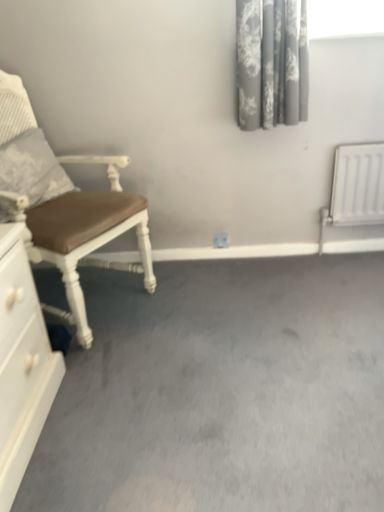
Question: Could you tell me if gray floral fabric curtain at upper right is facing white glossy chest of drawers at lower left?

Choices:
 (A) yes
 (B) no

Answer: (B)

Question: Can we say gray floral fabric curtain at upper right lies outside white glossy chest of drawers at lower left?

Choices:
 (A) yes
 (B) no

Answer: (A)

Question: Does gray floral fabric curtain at upper right appear on the left side of white glossy chest of drawers at lower left?

Choices:
 (A) yes
 (B) no

Answer: (B)

Question: Is gray floral fabric curtain at upper right bigger than white glossy chest of drawers at lower left?

Choices:
 (A) yes
 (B) no

Answer: (B)

Question: Does gray floral fabric curtain at upper right have a greater height compared to white glossy chest of drawers at lower left?

Choices:
 (A) no
 (B) yes

Answer: (A)

Question: Are gray floral fabric curtain at upper right and white glossy chest of drawers at lower left far apart?

Choices:
 (A) yes
 (B) no

Answer: (A)

Question: From the image's perspective, is textured gray pillow at left on top of brown leather chair at left?

Choices:
 (A) yes
 (B) no

Answer: (A)

Question: Could you tell me if textured gray pillow at left is facing brown leather chair at left?

Choices:
 (A) yes
 (B) no

Answer: (A)

Question: Is there a large distance between textured gray pillow at left and brown leather chair at left?

Choices:
 (A) yes
 (B) no

Answer: (B)

Question: From a real-world perspective, is textured gray pillow at left on top of brown leather chair at left?

Choices:
 (A) no
 (B) yes

Answer: (B)

Question: Is textured gray pillow at left to the right of brown leather chair at left from the viewer's perspective?

Choices:
 (A) yes
 (B) no

Answer: (B)

Question: Considering the relative sizes of textured gray pillow at left and brown leather chair at left in the image provided, is textured gray pillow at left wider than brown leather chair at left?

Choices:
 (A) yes
 (B) no

Answer: (B)

Question: From a real-world perspective, is textured gray pillow at left under white glossy chest of drawers at lower left?

Choices:
 (A) yes
 (B) no

Answer: (B)